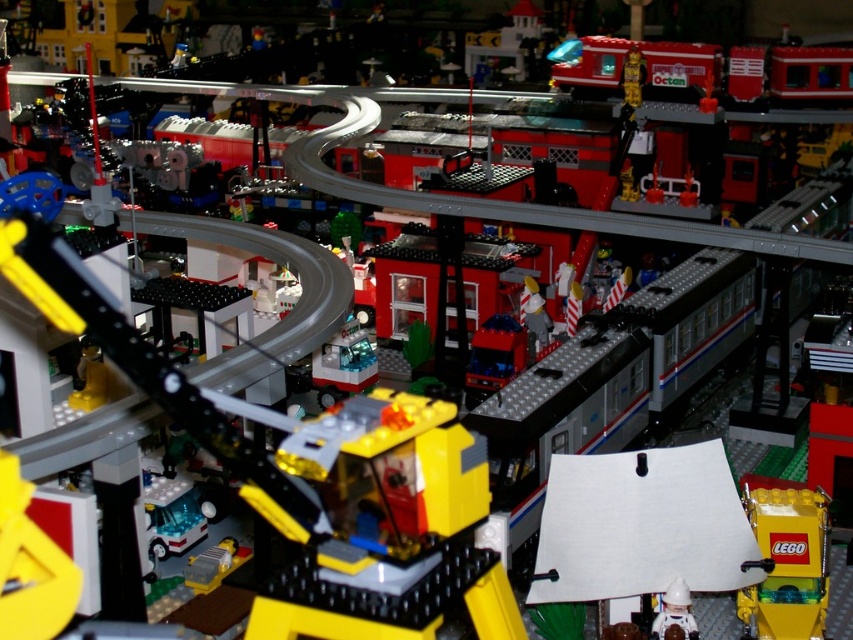
Question: Which point is farther to the camera?

Choices:
 (A) white plastic astronaut at lower right
 (B) yellow matte lego box at lower right

Answer: (B)

Question: Does yellow matte lego box at lower right have a greater width compared to white plastic astronaut at lower right?

Choices:
 (A) yes
 (B) no

Answer: (A)

Question: Is yellow matte lego box at lower right above white plastic astronaut at lower right?

Choices:
 (A) yes
 (B) no

Answer: (A)

Question: Among these objects, which one is nearest to the camera?

Choices:
 (A) white plastic astronaut at lower right
 (B) yellow matte lego box at lower right

Answer: (A)

Question: Does yellow matte lego box at lower right have a lesser width compared to white plastic astronaut at lower right?

Choices:
 (A) yes
 (B) no

Answer: (B)